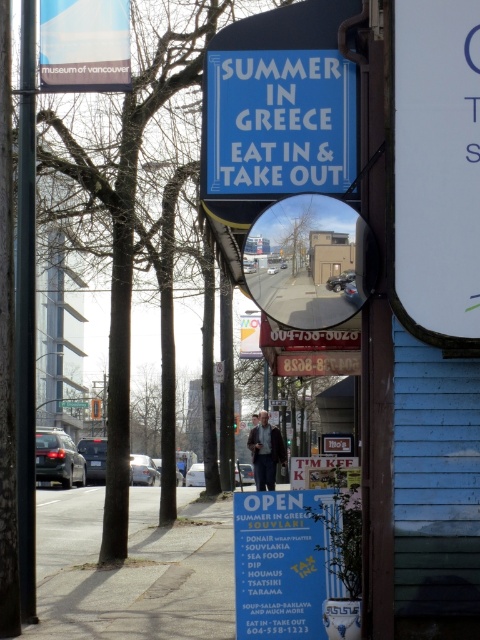
Question: Does white paper at upper right lie in front of black metal pole at left?

Choices:
 (A) no
 (B) yes

Answer: (B)

Question: Is white paper signboard at center behind green plastic street sign at upper center?

Choices:
 (A) no
 (B) yes

Answer: (A)

Question: Estimate the real-world distances between objects in this image. Which object is farther from the green plastic street sign at upper center?

Choices:
 (A) white paper at upper right
 (B) white paper signboard at center
 (C) black metal pole at left

Answer: (A)

Question: Among these points, which one is nearest to the camera?

Choices:
 (A) (62, 404)
 (B) (287, 544)
 (C) (427, 173)

Answer: (C)

Question: Which point appears closest to the camera in this image?

Choices:
 (A) (71, 401)
 (B) (458, 228)
 (C) (235, 544)

Answer: (B)

Question: Is black metal pole at left positioned at the back of green plastic street sign at upper center?

Choices:
 (A) yes
 (B) no

Answer: (B)